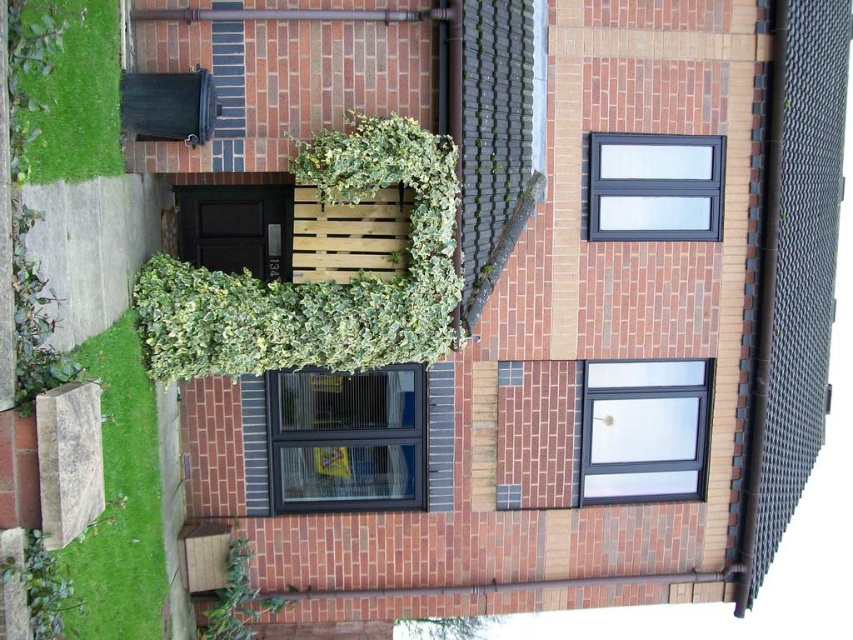
Question: Which point is farther to the camera?

Choices:
 (A) (236, 541)
 (B) (45, 592)
 (C) (155, 451)
 (D) (397, 145)

Answer: (A)

Question: Which of the following is the closest to the observer?

Choices:
 (A) green grass at lower left
 (B) green leafy plant at lower center
 (C) green leafy plant at center

Answer: (A)

Question: Does green leafy plant at center appear on the right side of green leafy plant at lower left?

Choices:
 (A) yes
 (B) no

Answer: (A)

Question: Is green grass at lower left thinner than green leafy plant at lower left?

Choices:
 (A) yes
 (B) no

Answer: (B)

Question: Can you confirm if green leafy plant at center is positioned to the left of green leafy plant at lower left?

Choices:
 (A) no
 (B) yes

Answer: (A)

Question: Which object is closer to the camera taking this photo?

Choices:
 (A) green leafy plant at lower left
 (B) green leafy grass at lower left

Answer: (A)